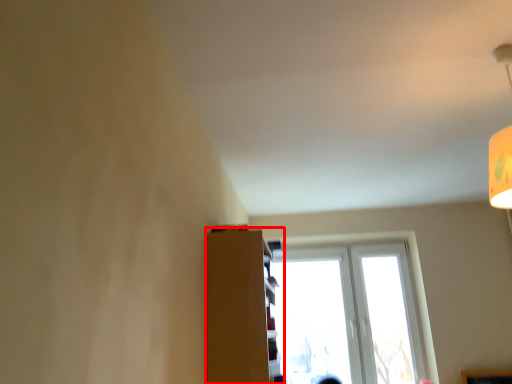
Question: From the image's perspective, considering the relative positions of shelf (annotated by the red box) and window in the image provided, where is shelf (annotated by the red box) located with respect to the staircase?

Choices:
 (A) above
 (B) below

Answer: (A)